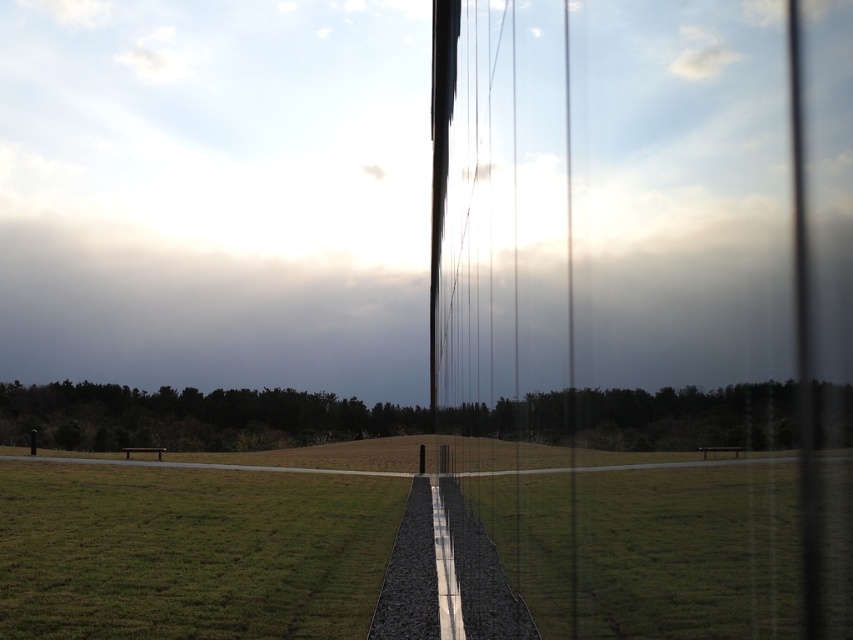
Question: Among these points, which one is farthest from the camera?

Choices:
 (A) (567, 378)
 (B) (54, 470)

Answer: (B)

Question: Which object appears closest to the camera in this image?

Choices:
 (A) transparent glass train window at center
 (B) green grass at center
 (C) green grass at lower left

Answer: (B)

Question: Which object is farther from the camera taking this photo?

Choices:
 (A) transparent glass train window at center
 (B) green grass at center
 (C) green grass at lower left

Answer: (C)

Question: Is transparent glass train window at center wider than green grass at lower left?

Choices:
 (A) yes
 (B) no

Answer: (B)

Question: In this image, where is transparent glass train window at center located relative to green grass at center?

Choices:
 (A) left
 (B) right

Answer: (A)

Question: Is green grass at lower left to the left of green grass at center from the viewer's perspective?

Choices:
 (A) no
 (B) yes

Answer: (B)